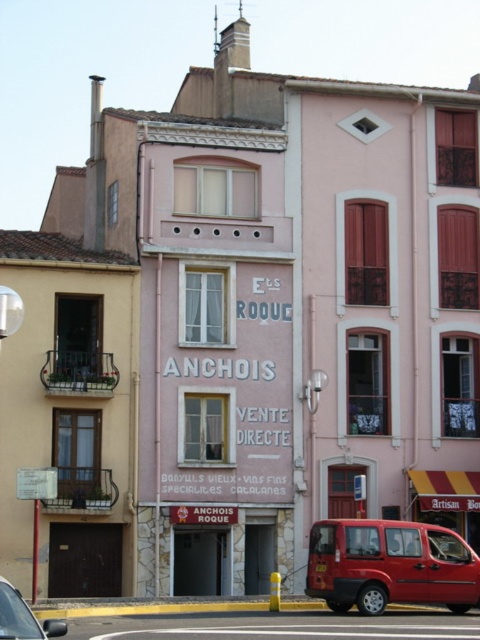
You are a pedestrian standing at the street corner and want to cross the road to reach the pink building with the sign. There is a metallic red van at lower center and a metallic silver car at lower left. Which vehicle is blocking your path closer to you?

The metallic silver car at lower left is behind the metallic red van at lower center, so the metallic red van at lower center is closer to you and blocking your path.

You are a delivery driver who needs to park your vehicle in this street scene. You have a truck that is 5 meters long. The metallic red van at lower center and the metallic silver car at lower left are already parked. Can your truck fit between them without overlapping either vehicle?

The metallic red van at lower center is shorter than the metallic silver car at lower left. However, the exact distance between them isn t provided, so we can t determine if the 5 meter truck will fit. More information is needed about the space between the two vehicles.